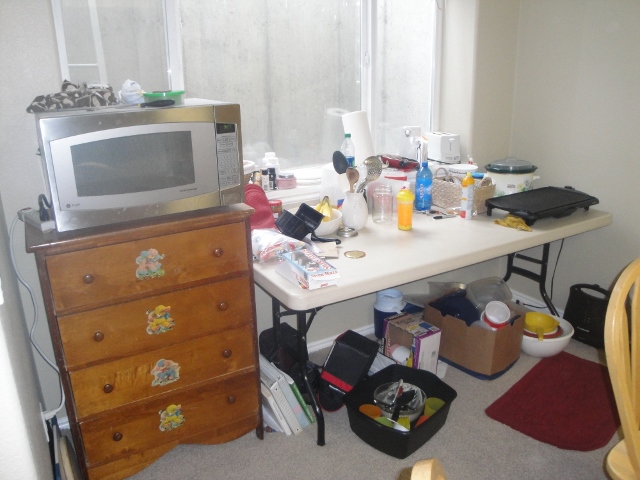
I want to click on table, so click(480, 254).